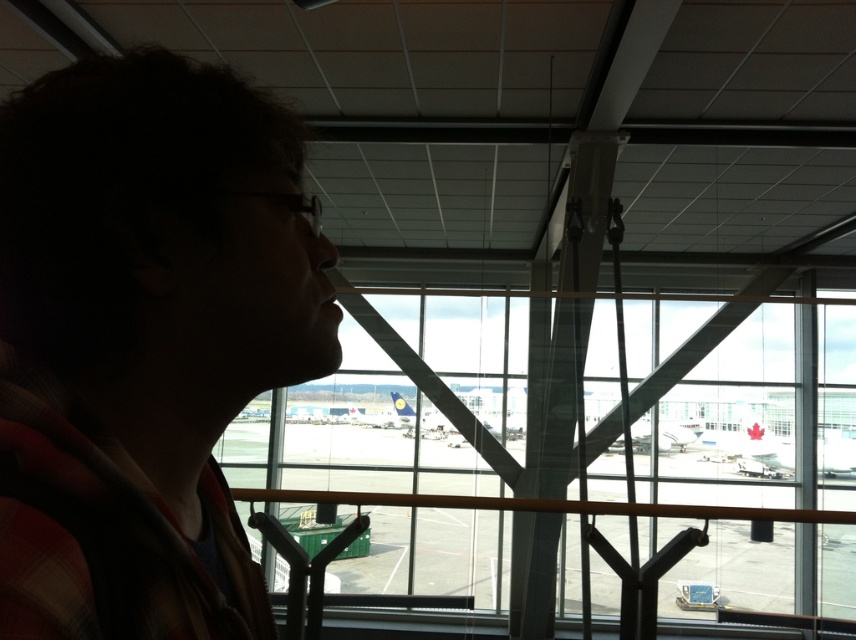
You are an airport staff member trying to determine if a new luggage cart, which is 1.2 meters wide, can fit through the space between the plaid fabric at left and the transparent glass window at center. Based on the scene, can the cart pass through?

The plaid fabric at left is narrower than the transparent glass window at center. Since the plaid fabric at left has a smaller width, the space between them might be sufficient for the 1.2 meters wide luggage cart. However, without exact measurements of the gap, it is uncertain. The answer should be based on the given information that the plaid fabric at left is less in width compared to the window, but the actual space between them isn